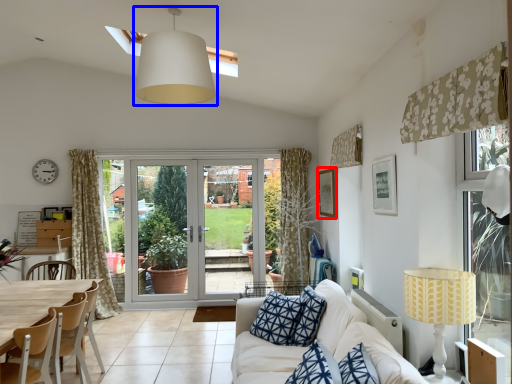
Question: Among these objects, which one is nearest to the camera, picture frame (highlighted by a red box) or lamp (highlighted by a blue box)?

Choices:
 (A) picture frame
 (B) lamp

Answer: (B)